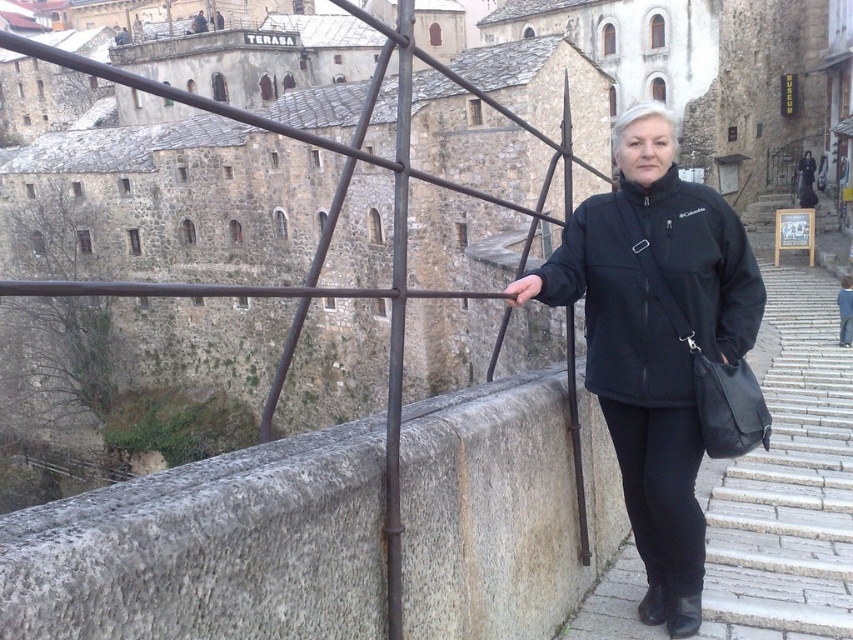
Question: Can you confirm if black softshell jacket at center is wider than gray stone stairs at lower right?

Choices:
 (A) no
 (B) yes

Answer: (A)

Question: Is black softshell jacket at center further to the viewer compared to gray stone stairs at lower right?

Choices:
 (A) yes
 (B) no

Answer: (A)

Question: Can you confirm if black softshell jacket at center is positioned to the left of gray stone stairs at lower right?

Choices:
 (A) no
 (B) yes

Answer: (B)